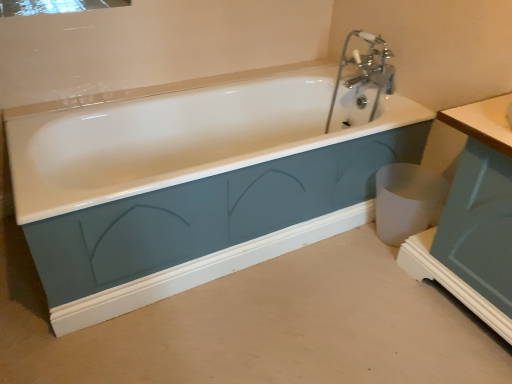
In order to click on vacant area that lies between matte teal cabinet at right and white glossy bathtub at center in this screenshot , I will do `click(316, 318)`.